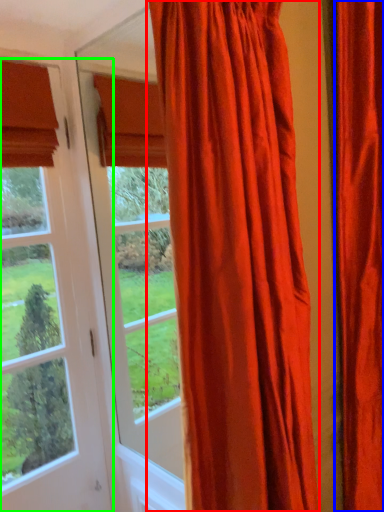
Question: Which object is the closest to the curtain (highlighted by a red box)? Choose among these: curtain (highlighted by a blue box) or window (highlighted by a green box).

Choices:
 (A) curtain
 (B) window

Answer: (A)